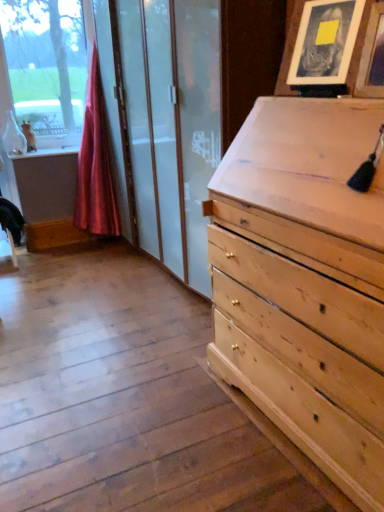
Question: From the image's perspective, is wooden picture frame at upper right, which is the first picture frame from front to back, above matte wooden picture frame at upper right, which appears as the first picture frame when viewed from the back?

Choices:
 (A) no
 (B) yes

Answer: (A)

Question: Is wooden picture frame at upper right, which is the first picture frame from front to back, next to matte wooden picture frame at upper right, which appears as the first picture frame when viewed from the back, and touching it?

Choices:
 (A) no
 (B) yes

Answer: (A)

Question: Is wooden picture frame at upper right, the second picture frame positioned from the back, wider than matte wooden picture frame at upper right, which appears as the 2th picture frame when viewed from the front?

Choices:
 (A) no
 (B) yes

Answer: (A)

Question: Is wooden picture frame at upper right, the second picture frame positioned from the back, outside matte wooden picture frame at upper right, which appears as the first picture frame when viewed from the back?

Choices:
 (A) yes
 (B) no

Answer: (A)

Question: Is matte wooden picture frame at upper right, which appears as the 2th picture frame when viewed from the front, at the back of wooden picture frame at upper right, the second picture frame positioned from the back?

Choices:
 (A) yes
 (B) no

Answer: (B)

Question: Considering the relative positions of wooden picture frame at upper right, the second picture frame positioned from the back, and matte wooden picture frame at upper right, which appears as the 2th picture frame when viewed from the front, in the image provided, is wooden picture frame at upper right, the second picture frame positioned from the back, to the left of matte wooden picture frame at upper right, which appears as the 2th picture frame when viewed from the front, from the viewer's perspective?

Choices:
 (A) no
 (B) yes

Answer: (A)

Question: Is silky red curtain at left far away from wooden picture frame at upper right, the second picture frame positioned from the back?

Choices:
 (A) no
 (B) yes

Answer: (B)

Question: Considering the relative sizes of silky red curtain at left and wooden picture frame at upper right, the second picture frame positioned from the back, in the image provided, is silky red curtain at left wider than wooden picture frame at upper right, the second picture frame positioned from the back,?

Choices:
 (A) no
 (B) yes

Answer: (B)

Question: Would you say wooden picture frame at upper right, the second picture frame positioned from the back, is part of silky red curtain at left's contents?

Choices:
 (A) no
 (B) yes

Answer: (A)

Question: Does silky red curtain at left have a greater height compared to wooden picture frame at upper right, which is the first picture frame from front to back?

Choices:
 (A) no
 (B) yes

Answer: (B)

Question: From a real-world perspective, is silky red curtain at left positioned over wooden picture frame at upper right, which is the first picture frame from front to back, based on gravity?

Choices:
 (A) no
 (B) yes

Answer: (A)

Question: Does silky red curtain at left have a smaller size compared to wooden picture frame at upper right, which is the first picture frame from front to back?

Choices:
 (A) no
 (B) yes

Answer: (A)

Question: Is silky red curtain at left positioned with its back to matte wooden picture frame at upper right, which appears as the 2th picture frame when viewed from the front?

Choices:
 (A) yes
 (B) no

Answer: (B)